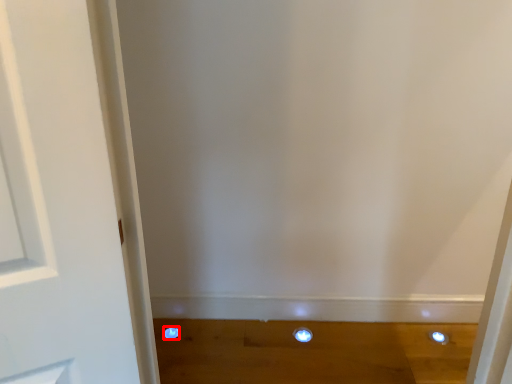
Question: From the image, what is the correct spatial relationship of dot (annotated by the red box) in relation to dot?

Choices:
 (A) left
 (B) right

Answer: (A)